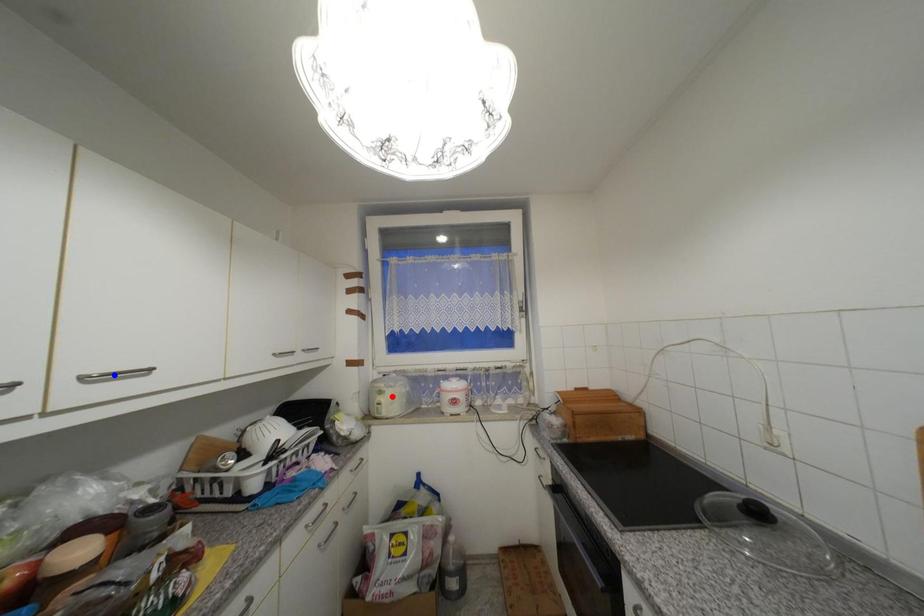
Question: Which of the two points in the image is closer to the camera?

Choices:
 (A) Blue point is closer.
 (B) Red point is closer.

Answer: (A)